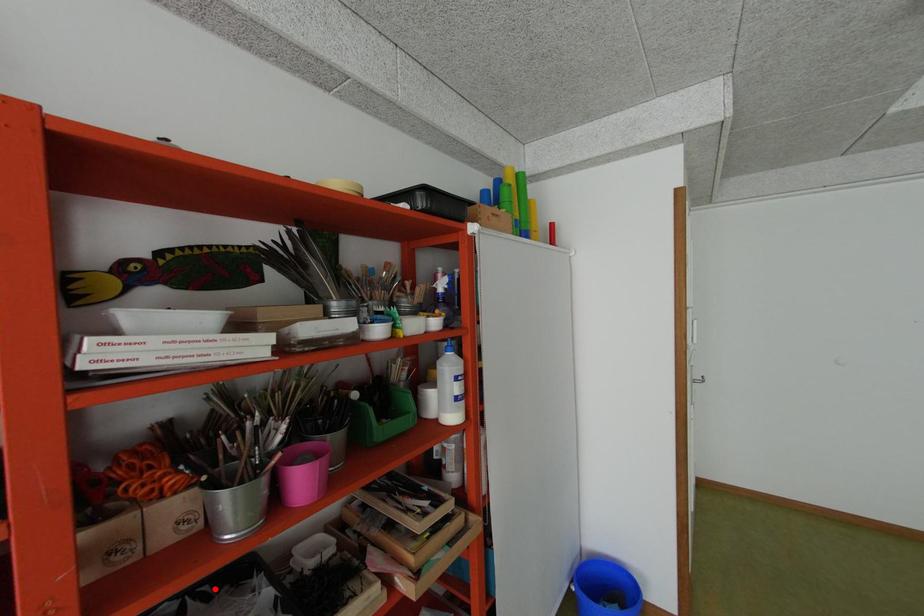
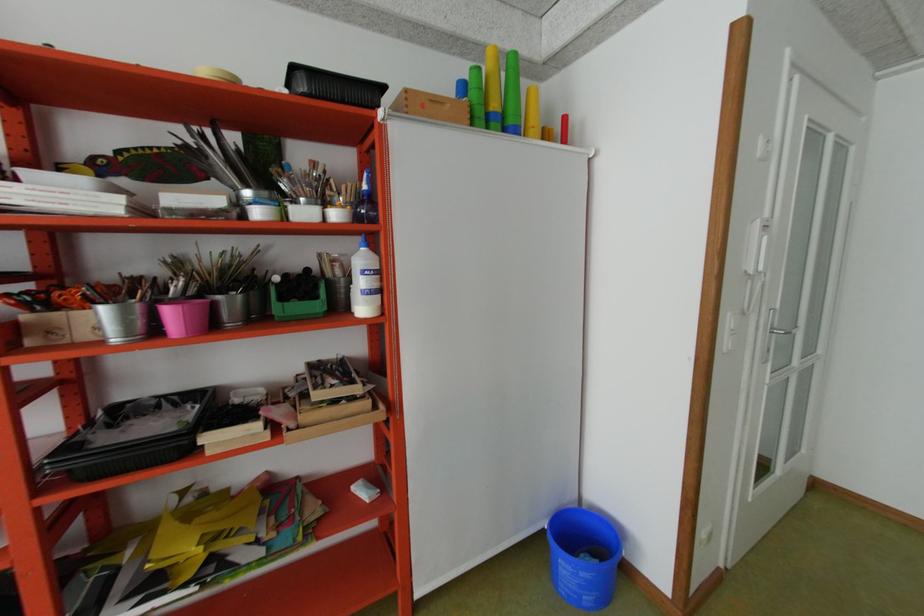
Where in the second image is the point corresponding to the highlighted location from the first image?

(185, 398)